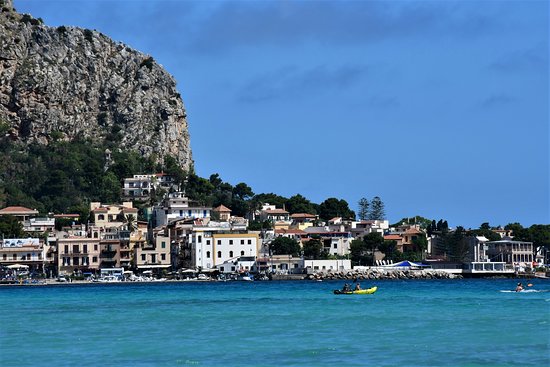
The width and height of the screenshot is (550, 367). In order to click on windows in this screenshot , I will do `click(231, 254)`, `click(219, 254)`, `click(162, 257)`, `click(95, 246)`, `click(209, 242)`.